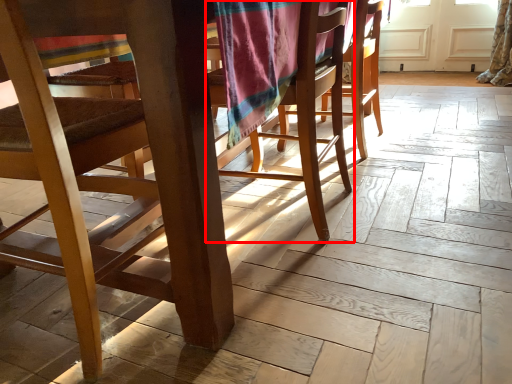
Question: From the image's perspective, considering the relative positions of chair (annotated by the red box) and chair in the image provided, where is chair (annotated by the red box) located with respect to the staircase?

Choices:
 (A) above
 (B) below

Answer: (A)